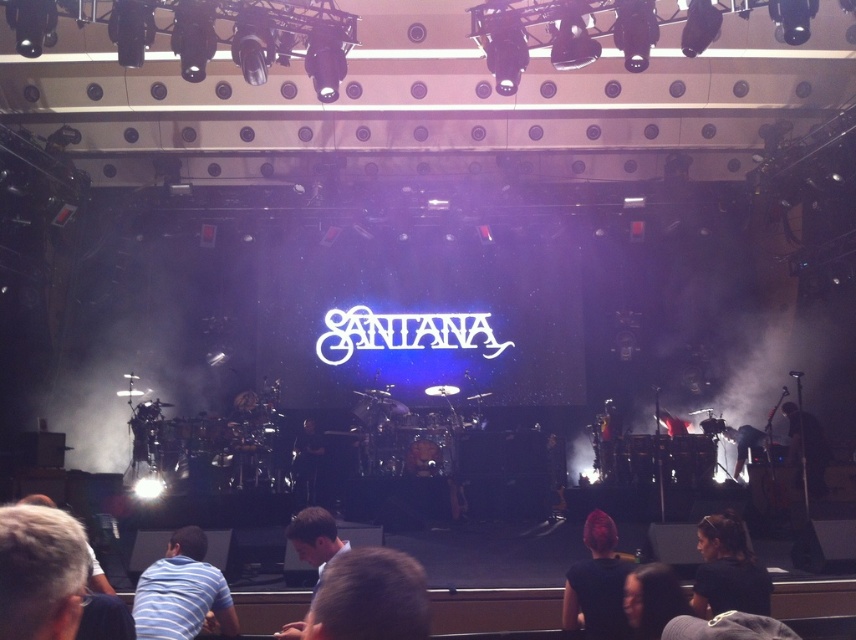
Question: Estimate the real-world distances between objects in this image. Which object is farther from the light brown hair at lower center?

Choices:
 (A) pink hair at center
 (B) black fabric hair at lower right

Answer: (B)

Question: In this image, where is pink hair at center located relative to light brown hair at lower center?

Choices:
 (A) above
 (B) below

Answer: (B)

Question: Does blonde hair at lower center appear over black leather guitar at center?

Choices:
 (A) yes
 (B) no

Answer: (A)

Question: Based on their relative distances, which object is farther from the black leather guitar at center?

Choices:
 (A) dark brown hair at lower center
 (B) light brown hair at lower center
 (C) pink hair at center
 (D) striped shirt at lower left

Answer: (A)

Question: Which object appears farthest from the camera in this image?

Choices:
 (A) striped shirt at lower left
 (B) black leather guitar at center

Answer: (B)

Question: Does striped shirt at lower left appear over pink hair at center?

Choices:
 (A) no
 (B) yes

Answer: (A)